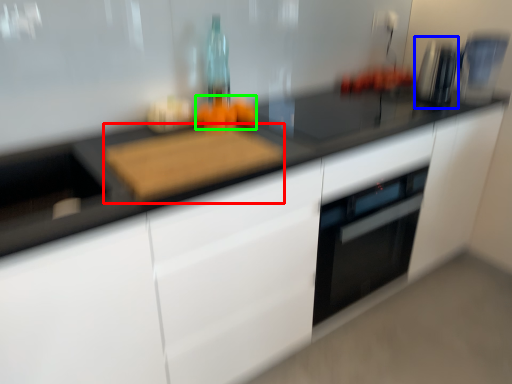
Question: Which is nearer to the cutting board (highlighted by a red box)? appliance (highlighted by a blue box) or food (highlighted by a green box).

Choices:
 (A) appliance
 (B) food

Answer: (B)